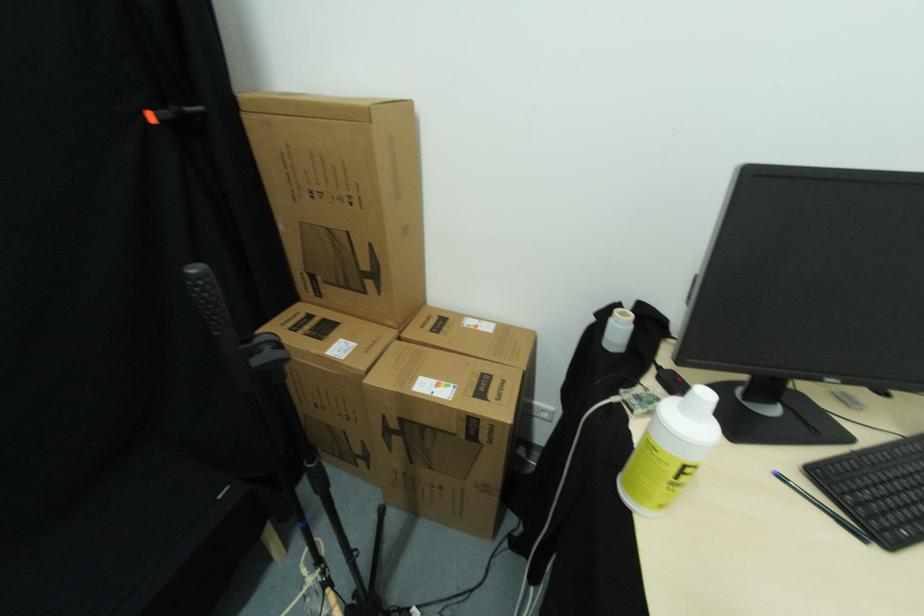
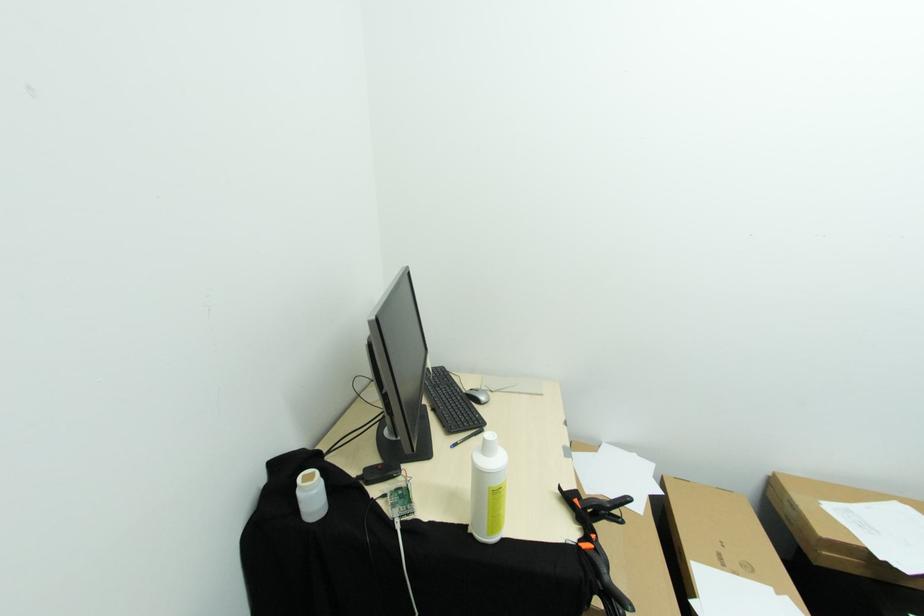
Where in the second image is the point corresponding to (622,330) from the first image?

(314, 495)